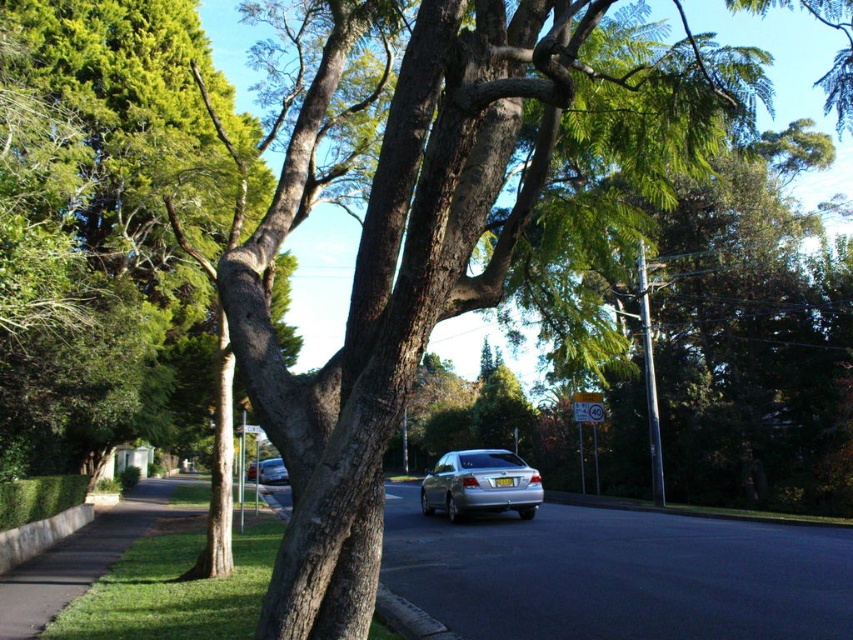
Can you confirm if gray asphalt road at center is positioned below satin silver sedan at center?

No.

Which of these two, gray asphalt road at center or satin silver sedan at center, stands taller?

With more height is satin silver sedan at center.

Which is in front, point (593, 563) or point (257, 472)?

Point (593, 563) is more forward.

Identify the location of gray asphalt road at center. This screenshot has width=853, height=640. (618, 573).

Does point (381, 609) come in front of point (260, 467)?

That is True.

Who is higher up, gray concrete curb at lower center or satin silver sedan at center?

Positioned higher is gray concrete curb at lower center.

Identify the location of gray concrete curb at lower center. (407, 618).

How much distance is there between silver metallic sedan at center and satin silver sedan at center?

silver metallic sedan at center and satin silver sedan at center are 15.57 meters apart from each other.

Is silver metallic sedan at center wider than satin silver sedan at center?

No, silver metallic sedan at center is not wider than satin silver sedan at center.

This screenshot has width=853, height=640. I want to click on silver metallic sedan at center, so click(x=480, y=484).

Identify the location of silver metallic sedan at center. (480, 484).